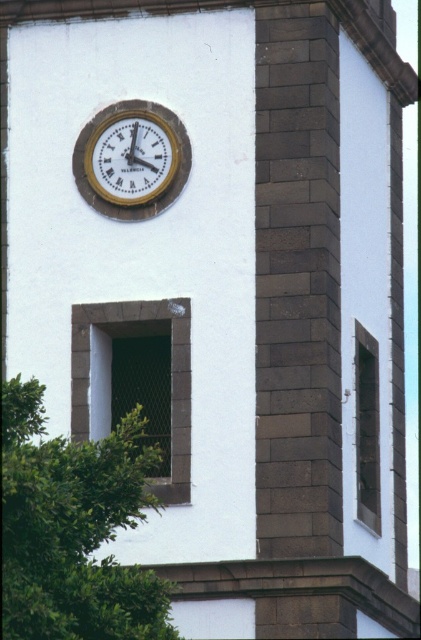
You are standing in front of the tower and notice the green leafy tree at lower left and the gold metallic clock at upper center. Which object is positioned higher in the image?

The gold metallic clock at upper center is positioned higher than the green leafy tree at lower left.

You are standing in front of the tower and notice the green leafy tree at lower left and the gold metallic clock at upper center. From your perspective, which object is positioned to the left?

The green leafy tree at lower left is positioned to the left of the gold metallic clock at upper center.

You are standing in front of the tower and want to take a photo of the green leafy tree at lower left. If your camera can focus on objects up to 50 meters away, will it be able to capture a clear image of the tree?

The green leafy tree at lower left is 49.29 meters away from viewer, so yes, the camera can focus on it since it is within the 50 meters range.